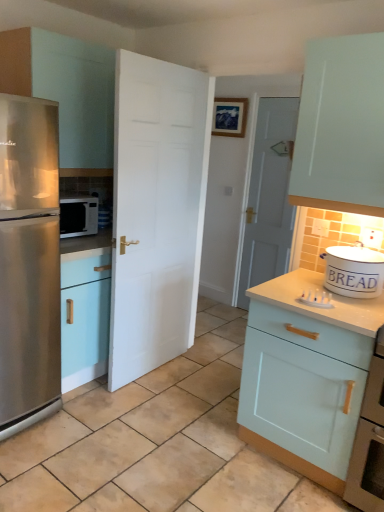
Locate an element on the screen. The height and width of the screenshot is (512, 384). white ceramic bread bin at right is located at coordinates (354, 271).

Identify the location of light blue wood cabinet at right, which is counted as the first cabinetry, starting from the right. (306, 375).

Describe the element at coordinates (65, 91) in the screenshot. This screenshot has width=384, height=512. I see `matte white cabinet at left, the 1th cabinetry in the left-to-right sequence` at that location.

The height and width of the screenshot is (512, 384). In order to click on beige tile at center in this screenshot , I will do `click(157, 442)`.

Looking at this image, is matte white cabinet at left, the 1th cabinetry in the left-to-right sequence, further to the viewer compared to white wooden door at center, the second door from the left?

No, the depth of matte white cabinet at left, the 1th cabinetry in the left-to-right sequence, is less than that of white wooden door at center, the second door from the left.

Looking at this image, considering the relative sizes of matte white cabinet at left, the 1th cabinetry in the left-to-right sequence, and white wooden door at center, the second door from the left, in the image provided, is matte white cabinet at left, the 1th cabinetry in the left-to-right sequence, bigger than white wooden door at center, the second door from the left,?

Yes, matte white cabinet at left, the 1th cabinetry in the left-to-right sequence, is bigger than white wooden door at center, the second door from the left.

Does point (70, 54) appear closer or farther from the camera than point (295, 115)?

Point (70, 54) is closer to the camera than point (295, 115).

At what (x,y) coordinates should I click in order to perform the action: click on the 1st door positioned below the matte white cabinet at left, the 1th cabinetry in the left-to-right sequence (from a real-world perspective). Please return your answer as a coordinate pair (x, y). The image size is (384, 512). Looking at the image, I should click on (269, 196).

What's the angular difference between beige tile at center and white wooden door at center, the second door from the left,'s facing directions?

90 degrees separate the facing orientations of beige tile at center and white wooden door at center, the second door from the left.

From the image's perspective, between beige tile at center and white wooden door at center, the 1th door in the back-to-front sequence, which one is located above?

white wooden door at center, the 1th door in the back-to-front sequence, from the image's perspective.

Does point (239, 379) lie in front of point (261, 236)?

That is True.

Find the location of a particular element. tile that is below the white wooden door at center, the 1th door in the back-to-front sequence (from the image's perspective) is located at coordinates (157, 442).

Is matte white cabinet at left, the 1th cabinetry in the left-to-right sequence, turned away from stainless steel refrigerator at left?

No.

I want to click on refrigerator in front of the matte white cabinet at left, the second cabinetry when ordered from right to left, so click(29, 261).

Between matte white cabinet at left, the second cabinetry when ordered from right to left, and stainless steel refrigerator at left, which one has larger size?

stainless steel refrigerator at left.

Which of these two, matte white cabinet at left, placed as the 1th cabinetry when sorted from top to bottom, or stainless steel refrigerator at left, stands taller?

stainless steel refrigerator at left is taller.

Who is bigger, matte white cabinet at left, the second cabinetry when ordered from right to left, or white matte door at center, marked as the second door in a back-to-front arrangement?

With larger size is matte white cabinet at left, the second cabinetry when ordered from right to left.

From the picture: Which object is closer to the camera taking this photo, matte white cabinet at left, the second cabinetry when ordered from right to left, or white matte door at center, marked as the second door in a back-to-front arrangement?

white matte door at center, marked as the second door in a back-to-front arrangement, is more forward.

Are matte white cabinet at left, arranged as the 2th cabinetry when ordered from the bottom, and white matte door at center, positioned as the 1th door in left-to-right order, far apart?

No, matte white cabinet at left, arranged as the 2th cabinetry when ordered from the bottom, is not far away from white matte door at center, positioned as the 1th door in left-to-right order.

From the image's perspective, is stainless steel refrigerator at left located above beige tile at center?

Yes, from the image's perspective, stainless steel refrigerator at left is above beige tile at center.

Does stainless steel refrigerator at left appear on the left side of beige tile at center?

Correct, you'll find stainless steel refrigerator at left to the left of beige tile at center.

Which object is further away from the camera, stainless steel refrigerator at left or beige tile at center?

stainless steel refrigerator at left.

Does stainless steel refrigerator at left have a lesser width compared to beige tile at center?

Correct, the width of stainless steel refrigerator at left is less than that of beige tile at center.

Does stainless steel refrigerator at left have a lesser width compared to light blue wood cabinet at right, the first cabinetry from the bottom?

Incorrect, the width of stainless steel refrigerator at left is not less than that of light blue wood cabinet at right, the first cabinetry from the bottom.

Is point (30, 312) closer to viewer compared to point (270, 366)?

No.

Does matte white cabinet at left, arranged as the 2th cabinetry when ordered from the bottom, have a smaller size compared to satin silver microwave at left?

No, matte white cabinet at left, arranged as the 2th cabinetry when ordered from the bottom, is not smaller than satin silver microwave at left.

Is matte white cabinet at left, the 1th cabinetry in the left-to-right sequence, placed right next to satin silver microwave at left?

matte white cabinet at left, the 1th cabinetry in the left-to-right sequence, and satin silver microwave at left are clearly separated.

Considering the positions of objects matte white cabinet at left, arranged as the 2th cabinetry when ordered from the bottom, and satin silver microwave at left in the image provided, who is more to the right, matte white cabinet at left, arranged as the 2th cabinetry when ordered from the bottom, or satin silver microwave at left?

From the viewer's perspective, matte white cabinet at left, arranged as the 2th cabinetry when ordered from the bottom, appears more on the right side.

Where is `the 1st cabinetry in front of the white wooden door at center, positioned as the 1th door in right-to-left order, counting from the anchor's position`? The height and width of the screenshot is (512, 384). the 1st cabinetry in front of the white wooden door at center, positioned as the 1th door in right-to-left order, counting from the anchor's position is located at coordinates (65, 91).

Locate an element on the screen. This screenshot has width=384, height=512. door on the right of beige tile at center is located at coordinates (269, 196).

Looking at the image, which one is located closer to light blue wood cabinet at right, the first cabinetry from the bottom, white matte door at center, the 1th door viewed from the front, or white ceramic bread bin at right?

white ceramic bread bin at right lies closer to light blue wood cabinet at right, the first cabinetry from the bottom, than the other object.

Looking at the image, which one is located closer to light blue wood cabinet at right, the first cabinetry from the bottom, stainless steel refrigerator at left or beige tile at center?

The object closer to light blue wood cabinet at right, the first cabinetry from the bottom, is beige tile at center.

Looking at the image, which one is located closer to satin silver microwave at left, white matte door at center, which ranks as the 2th door in right-to-left order, or beige tile at center?

Among the two, white matte door at center, which ranks as the 2th door in right-to-left order, is located nearer to satin silver microwave at left.

When comparing their distances from white wooden door at center, the 1th door in the back-to-front sequence, does white ceramic bread bin at right or stainless steel refrigerator at left seem further?

stainless steel refrigerator at left.

From the picture: Which object lies further to the anchor point beige tile at center, white ceramic bread bin at right or stainless steel refrigerator at left?

The object further to beige tile at center is white ceramic bread bin at right.

From the image, which object appears to be nearer to white ceramic bread bin at right, stainless steel refrigerator at left or beige tile at center?

The object closer to white ceramic bread bin at right is beige tile at center.

Based on their spatial positions, is white ceramic bread bin at right or beige tile at center closer to satin silver microwave at left?

Based on the image, beige tile at center appears to be nearer to satin silver microwave at left.

Looking at the image, which one is located further to white wooden door at center, placed as the second door when sorted from front to back, white matte door at center, marked as the second door in a back-to-front arrangement, or matte white cabinet at left, placed as the 1th cabinetry when sorted from top to bottom?

matte white cabinet at left, placed as the 1th cabinetry when sorted from top to bottom, is further to white wooden door at center, placed as the second door when sorted from front to back.

Where is `tile between satin silver microwave at left and light blue wood cabinet at right, the second cabinetry positioned from the left, in the horizontal direction`? The image size is (384, 512). tile between satin silver microwave at left and light blue wood cabinet at right, the second cabinetry positioned from the left, in the horizontal direction is located at coordinates (157, 442).

Where is `microwave oven between matte white cabinet at left, placed as the 1th cabinetry when sorted from top to bottom, and white matte door at center, marked as the second door in a back-to-front arrangement, vertically`? The image size is (384, 512). microwave oven between matte white cabinet at left, placed as the 1th cabinetry when sorted from top to bottom, and white matte door at center, marked as the second door in a back-to-front arrangement, vertically is located at coordinates (78, 215).

Locate an element on the screen. This screenshot has width=384, height=512. appliance between matte white cabinet at left, the second cabinetry when ordered from right to left, and beige tile at center vertically is located at coordinates (354, 271).

The image size is (384, 512). Identify the location of appliance between light blue wood cabinet at right, marked as the 2th cabinetry in a top-to-bottom arrangement, and white wooden door at center, positioned as the 1th door in right-to-left order, in the front-back direction. (354, 271).